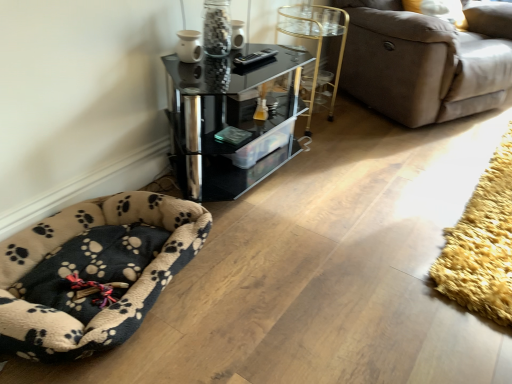
I want to click on free space that is in between gold metallic side table at upper center and yellow shaggy rug at lower right, so click(x=408, y=164).